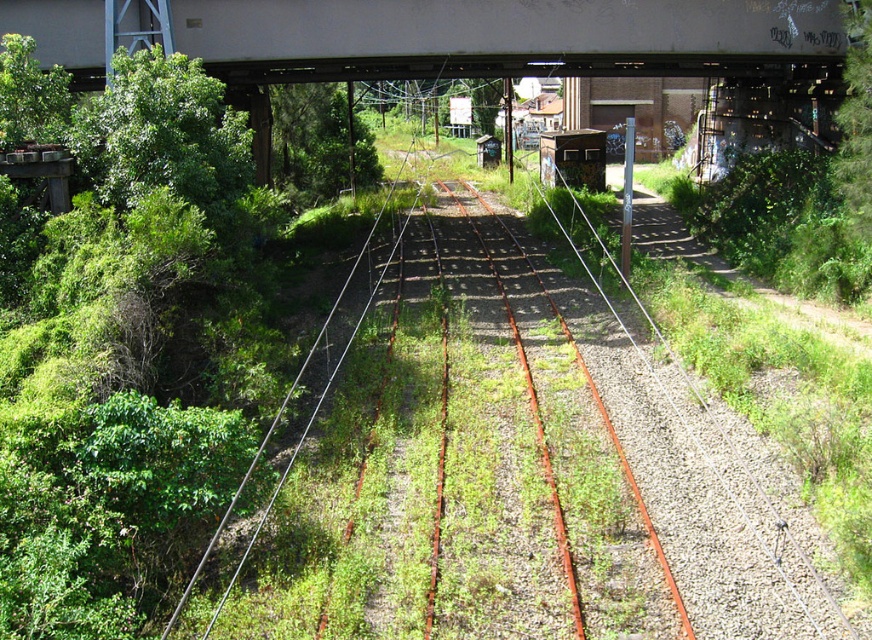
Question: Which point is closer to the camera?

Choices:
 (A) (397, 76)
 (B) (319, 193)

Answer: (A)

Question: Can you confirm if green grassy track at center is thinner than green leafy tree at right?

Choices:
 (A) yes
 (B) no

Answer: (B)

Question: Can you confirm if white painted steel bridge at upper center is smaller than green leafy tree at center?

Choices:
 (A) yes
 (B) no

Answer: (A)

Question: Which point is closer to the camera taking this photo?

Choices:
 (A) (460, 212)
 (B) (816, 10)

Answer: (B)

Question: Among these objects, which one is nearest to the camera?

Choices:
 (A) green leafy tree at center
 (B) white painted steel bridge at upper center

Answer: (B)

Question: Where is green leafy tree at left located in relation to green leafy tree at center in the image?

Choices:
 (A) left
 (B) right

Answer: (B)